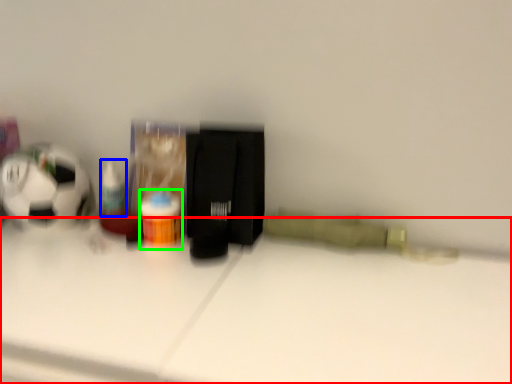
Question: Which object is positioned farthest from table (highlighted by a red box)? Select from toiletry (highlighted by a blue box) and bottle (highlighted by a green box).

Choices:
 (A) toiletry
 (B) bottle

Answer: (A)